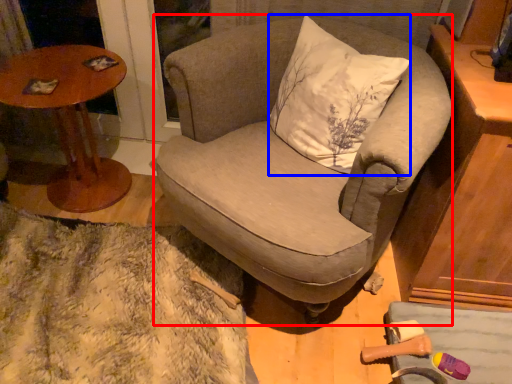
Question: Which point is further to the camera, chair (highlighted by a red box) or pillow (highlighted by a blue box)?

Choices:
 (A) chair
 (B) pillow

Answer: (B)